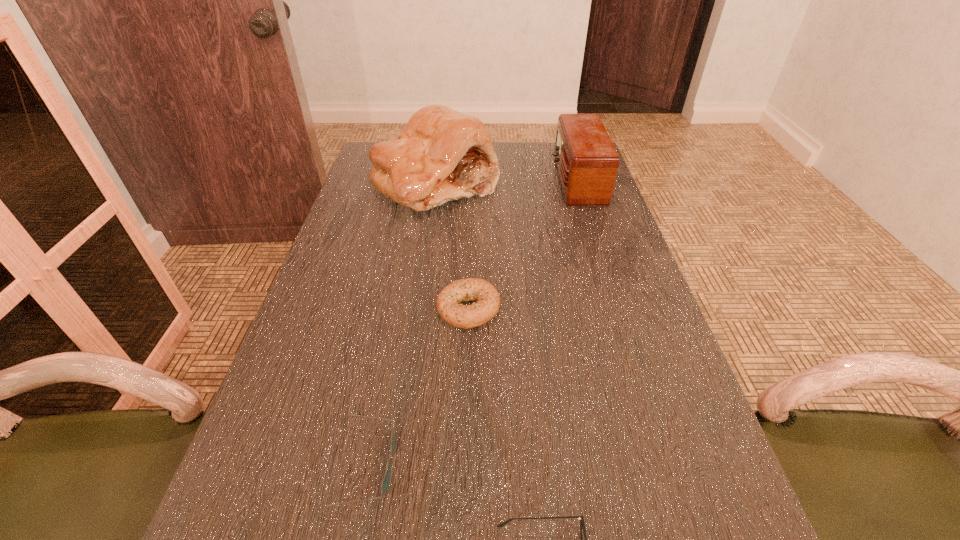
Where is `free space located 0.150m on the lenses of the sunglasses`? The width and height of the screenshot is (960, 540). free space located 0.150m on the lenses of the sunglasses is located at coordinates (488, 465).

Image resolution: width=960 pixels, height=540 pixels. In order to click on bread present at the far edge in this screenshot , I will do `click(441, 155)`.

At what (x,y) coordinates should I click in order to perform the action: click on radio receiver that is at the far edge. Please return your answer as a coordinate pair (x, y). Looking at the image, I should click on (587, 162).

Identify the location of bread present at the left edge. The height and width of the screenshot is (540, 960). (441, 155).

You are a GUI agent. You are given a task and a screenshot of the screen. Output one action in this format:
    pyautogui.click(x=<x>, y=<y>)
    Task: Click on the sunglasses at the left edge
    This screenshot has width=960, height=540.
    Given the screenshot: What is the action you would take?
    pyautogui.click(x=385, y=485)

The image size is (960, 540). In order to click on object located at the right edge in this screenshot , I will do `click(587, 162)`.

Where is `object at the far left corner`? The width and height of the screenshot is (960, 540). object at the far left corner is located at coordinates (441, 155).

At what (x,y) coordinates should I click in order to perform the action: click on object at the far right corner. Please return your answer as a coordinate pair (x, y). The width and height of the screenshot is (960, 540). Looking at the image, I should click on (587, 162).

The image size is (960, 540). In order to click on vacant space at the far edge in this screenshot , I will do `click(540, 148)`.

At what (x,y) coordinates should I click in order to perform the action: click on vacant space at the left edge of the desktop. Please return your answer as a coordinate pair (x, y). The width and height of the screenshot is (960, 540). Looking at the image, I should click on (363, 207).